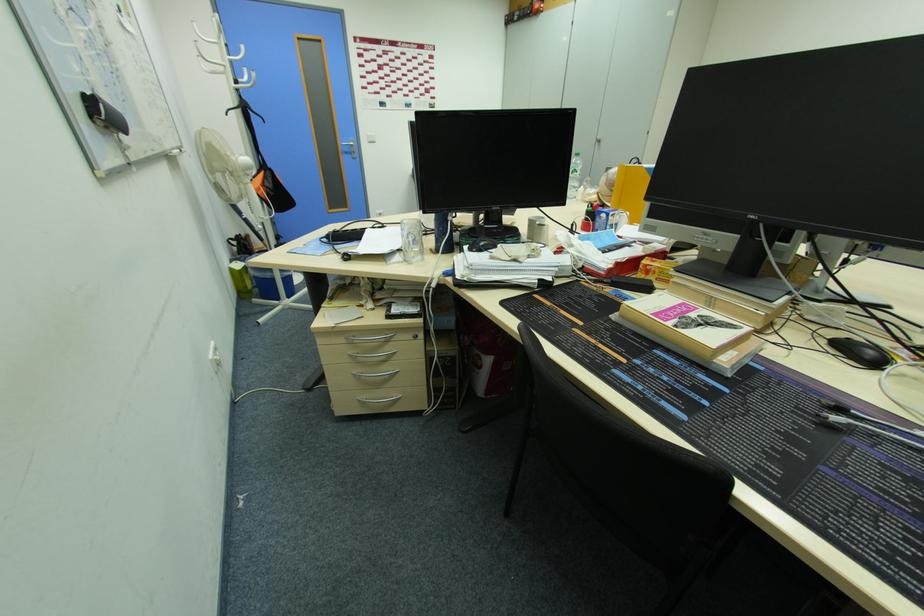
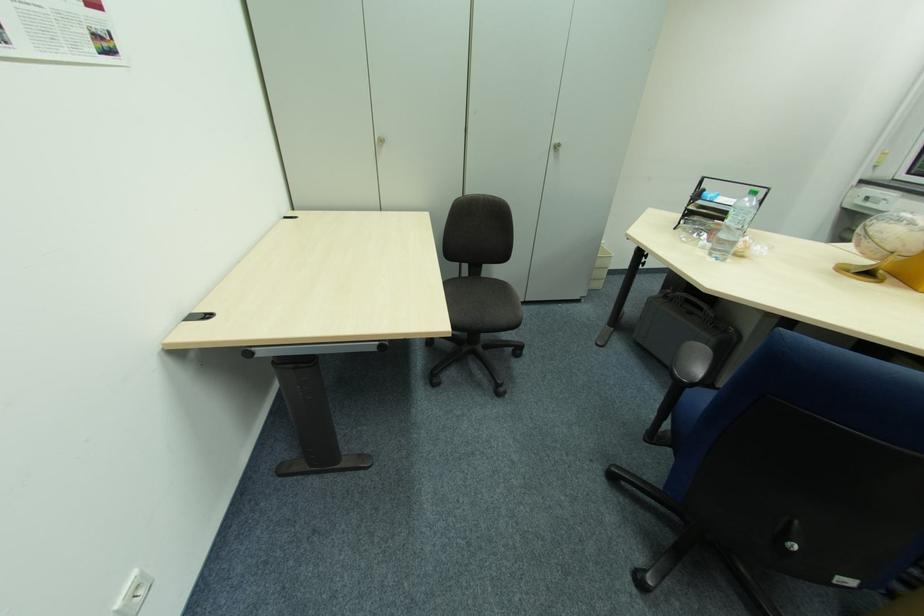
The point at (600, 145) is marked in the first image. Where is the corresponding point in the second image?

(554, 150)